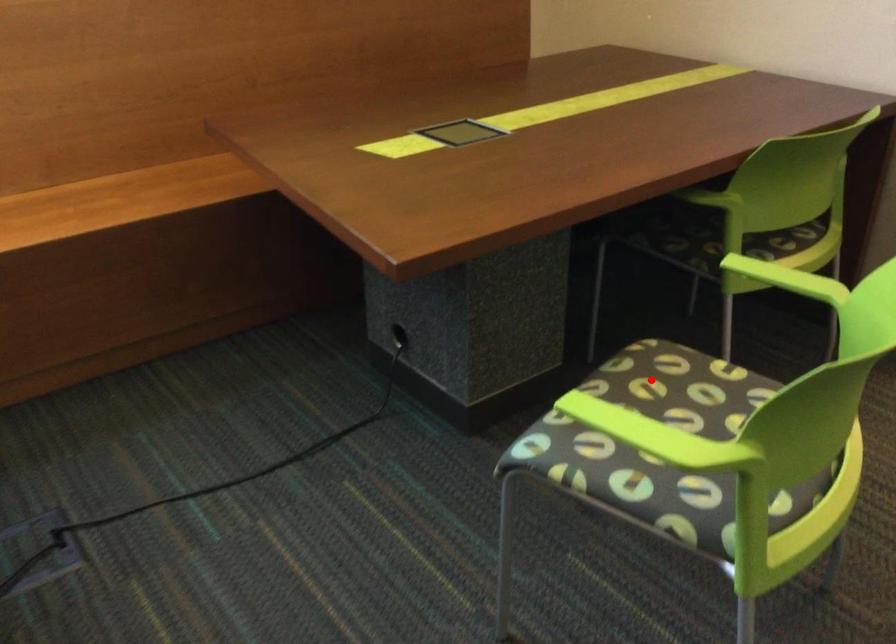
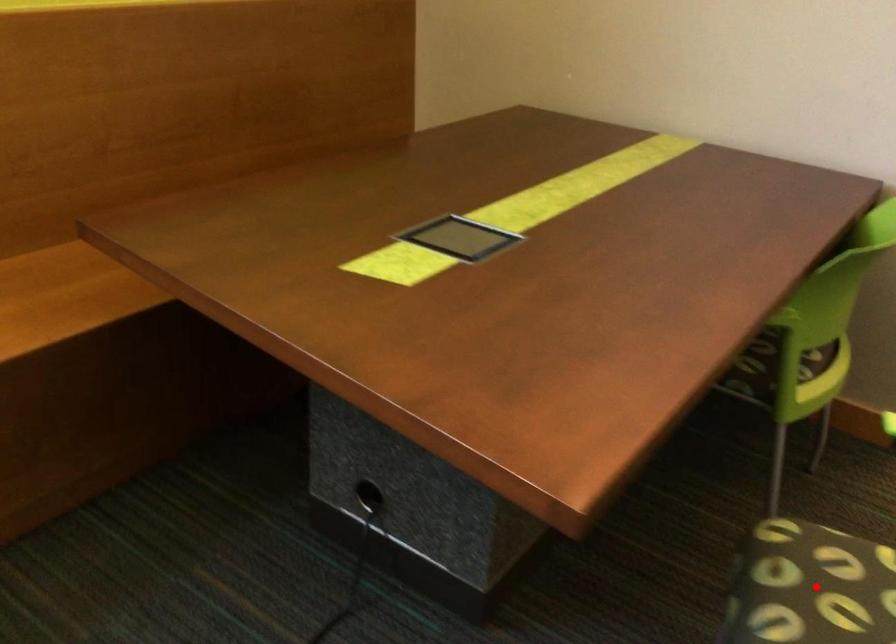
I am providing you with two images of the same scene from different viewpoints. A red point is marked on the first image and another point is marked on the second image. Are the points marked in image1 and image2 representing the same 3D position?

Yes